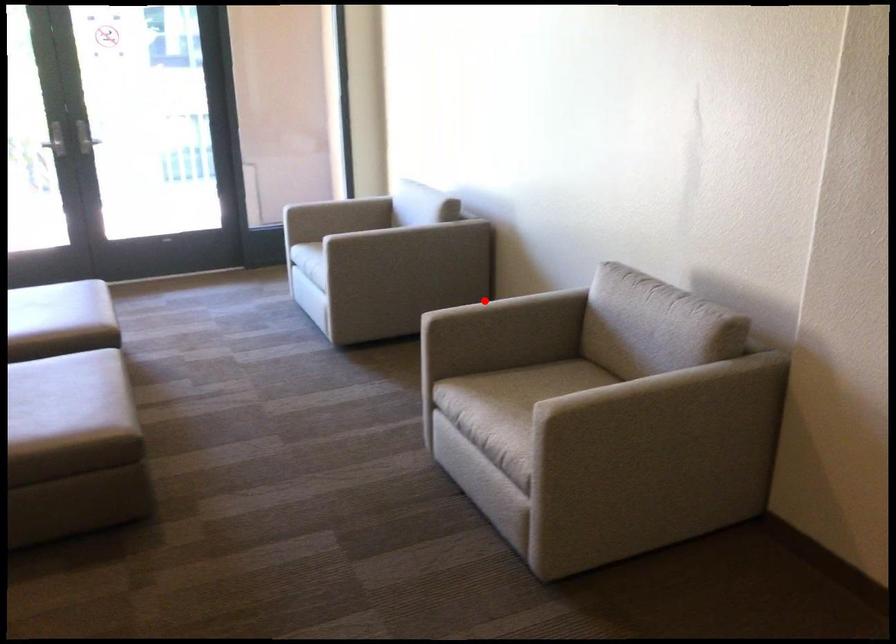
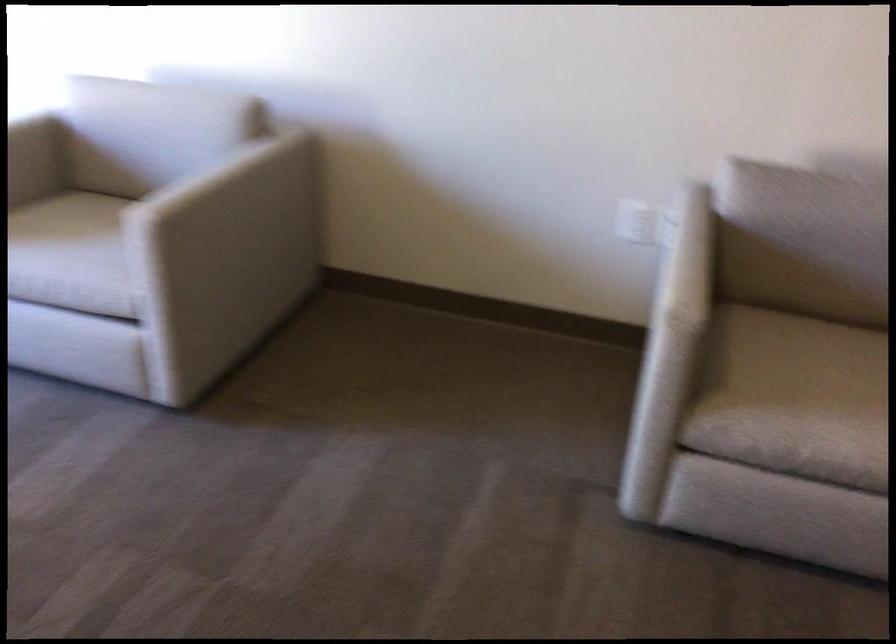
Question: I am providing you with two images of the same scene from different viewpoints. A red point is shown in image1. For the corresponding object point in image2, is it positioned nearer or farther from the camera?

Choices:
 (A) Nearer
 (B) Farther

Answer: (A)